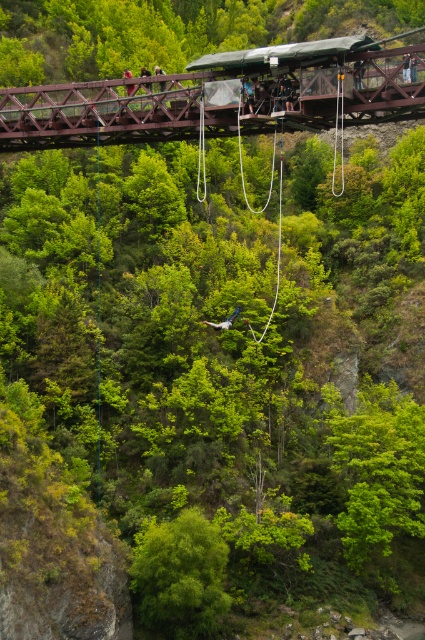
Question: Is brown wooden bridge at upper center closer to camera compared to white fabric parachute at center?

Choices:
 (A) yes
 (B) no

Answer: (A)

Question: Does brown wooden bridge at upper center appear over white fabric parachute at center?

Choices:
 (A) no
 (B) yes

Answer: (B)

Question: Does brown wooden bridge at upper center come in front of white fabric parachute at center?

Choices:
 (A) yes
 (B) no

Answer: (A)

Question: Which point is farther from the camera taking this photo?

Choices:
 (A) (232, 314)
 (B) (260, 115)

Answer: (A)